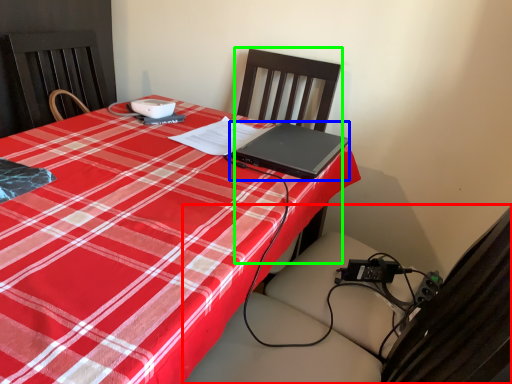
Question: Estimate the real-world distances between objects in this image. Which object is closer to swivel chair (highlighted by a red box), laptop (highlighted by a blue box) or chair (highlighted by a green box)?

Choices:
 (A) laptop
 (B) chair

Answer: (A)